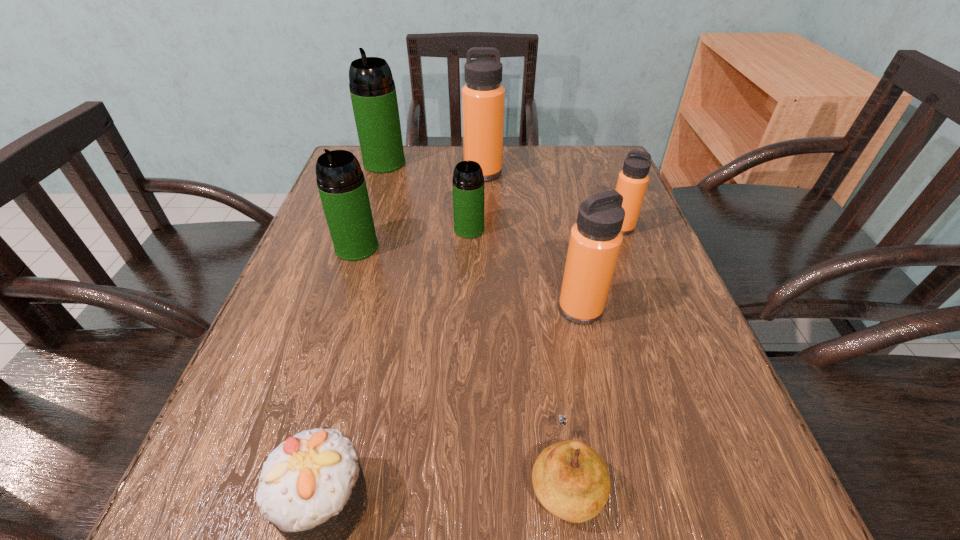
The image size is (960, 540). What are the coordinates of `vacant space at the near edge of the desktop` in the screenshot? It's located at (508, 521).

Where is `vacant area at the left edge of the desktop`? The width and height of the screenshot is (960, 540). vacant area at the left edge of the desktop is located at coordinates (351, 322).

The height and width of the screenshot is (540, 960). Find the location of `vacant space at the right edge of the desktop`. vacant space at the right edge of the desktop is located at coordinates (684, 467).

In the image, there is a desktop. At what (x,y) coordinates should I click in order to perform the action: click on vacant space at the far right corner. Please return your answer as a coordinate pair (x, y). This screenshot has width=960, height=540. Looking at the image, I should click on (612, 184).

The image size is (960, 540). What are the coordinates of `free space between the second orange thermos bottle from right to left and the biggest green thermos bottle` in the screenshot? It's located at (483, 236).

Where is `free area in between the second smallest green thermos bottle and the farthest orange thermos bottle`? This screenshot has height=540, width=960. free area in between the second smallest green thermos bottle and the farthest orange thermos bottle is located at coordinates (420, 210).

The height and width of the screenshot is (540, 960). In order to click on free space between the second biggest green thermos bottle and the leftmost orange thermos bottle in this screenshot , I will do `click(420, 210)`.

Locate an element on the screen. vacant area between the sixth farthest object and the rightmost green thermos bottle is located at coordinates (525, 269).

The image size is (960, 540). Identify the location of vacant area between the rightmost green thermos bottle and the second biggest green thermos bottle. (413, 238).

What are the coordinates of `empty location between the nearest orange thermos bottle and the leftmost orange thermos bottle` in the screenshot? It's located at (532, 241).